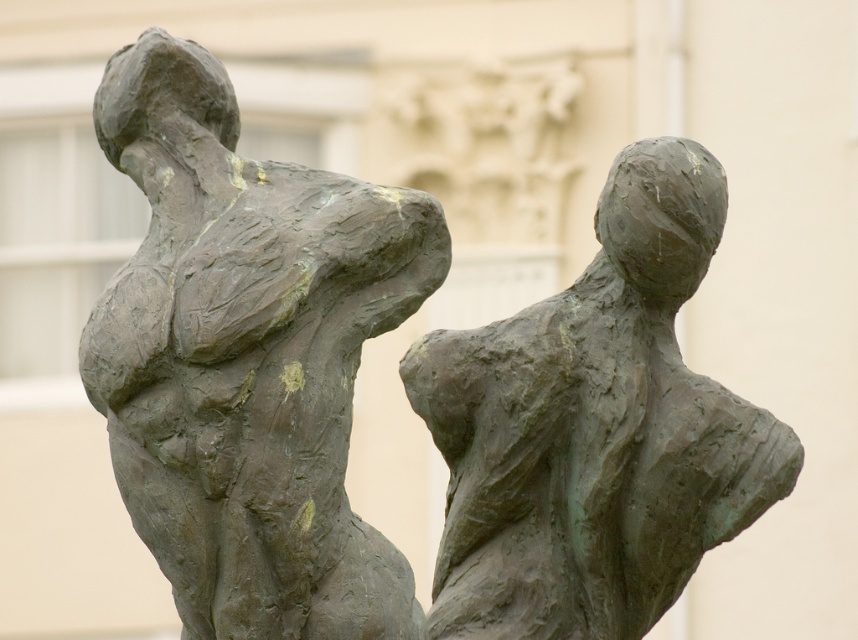
Question: Which of the following is the farthest from the observer?

Choices:
 (A) (461, 556)
 (B) (173, 292)

Answer: (A)

Question: Does bronze statue at center have a lesser width compared to green patina bronze figure at center?

Choices:
 (A) no
 (B) yes

Answer: (B)

Question: Can you confirm if bronze statue at center is thinner than green patina bronze figure at center?

Choices:
 (A) no
 (B) yes

Answer: (B)

Question: Which of the following is the closest to the observer?

Choices:
 (A) bronze statue at center
 (B) green patina bronze figure at center

Answer: (A)

Question: Is bronze statue at center to the right of green patina bronze figure at center from the viewer's perspective?

Choices:
 (A) no
 (B) yes

Answer: (A)